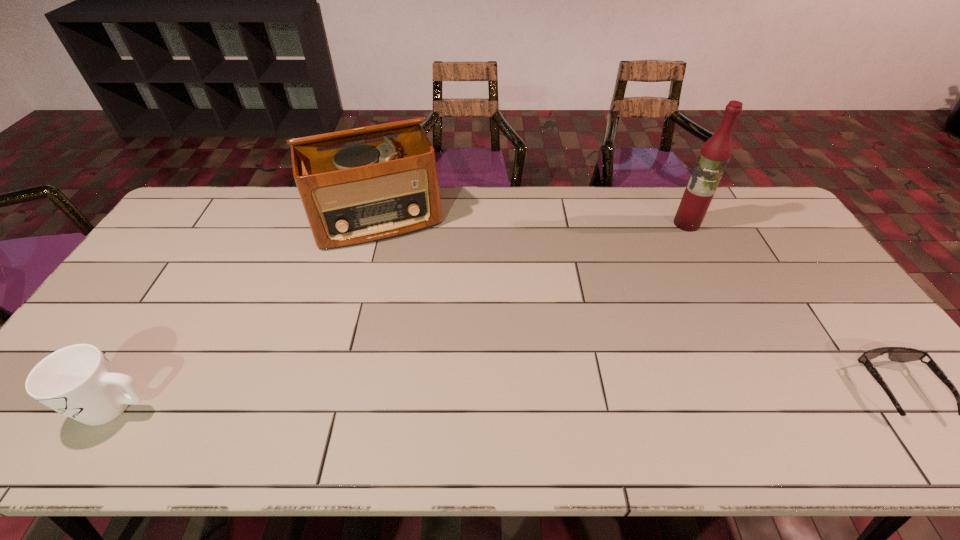
Identify the location of free spot on the desktop that is between the mug and the shortest object and is positioned on the front panel of the second object from left to right. The image size is (960, 540). (432, 400).

Where is `free space on the desktop that is between the second shortest object and the rightmost object and is positioned on the label of the second object from right to left`? This screenshot has width=960, height=540. free space on the desktop that is between the second shortest object and the rightmost object and is positioned on the label of the second object from right to left is located at coordinates (579, 396).